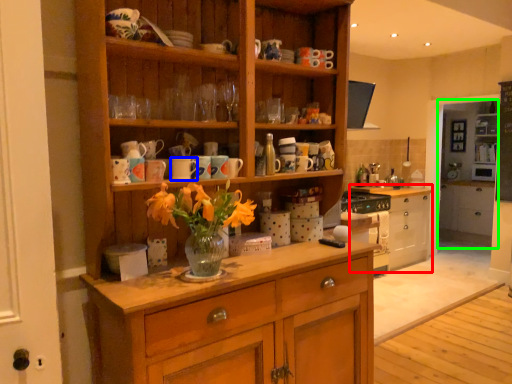
Question: Based on their relative distances, which object is nearer to chest of drawers (highlighted by a red box)? Choose from mug (highlighted by a blue box) and shelf (highlighted by a green box).

Choices:
 (A) mug
 (B) shelf

Answer: (B)